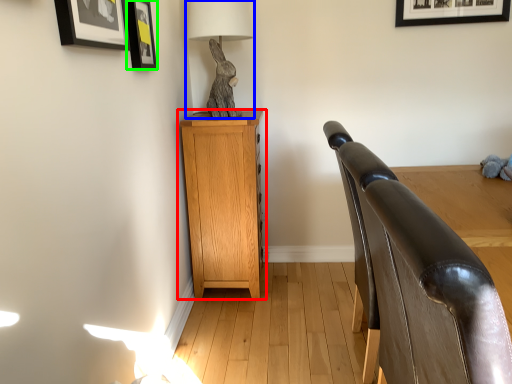
Question: Based on their relative distances, which object is nearer to nightstand (highlighted by a red box)? Choose from table lamp (highlighted by a blue box) and picture frame (highlighted by a green box).

Choices:
 (A) table lamp
 (B) picture frame

Answer: (A)